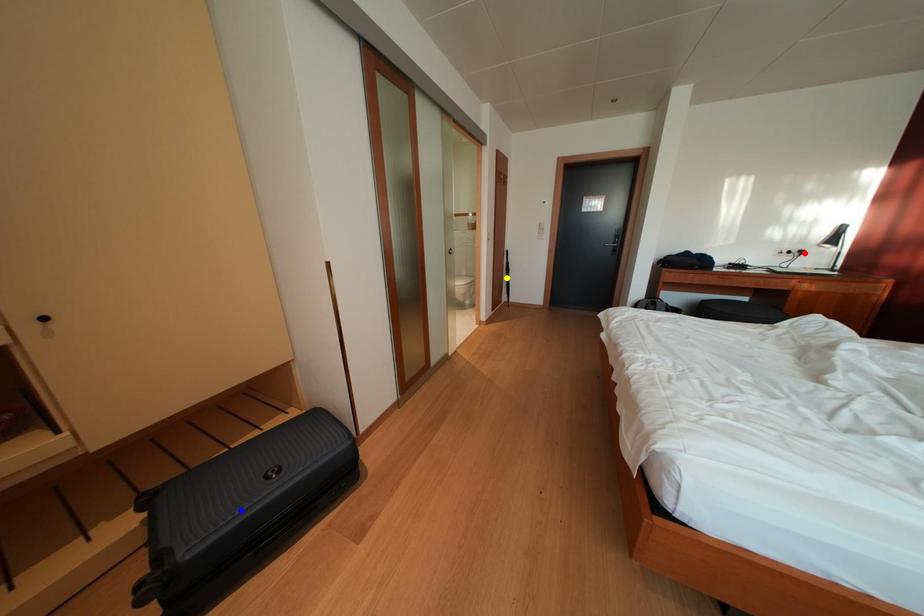
Order these from nearest to farthest:
blue point
red point
yellow point

blue point → red point → yellow point